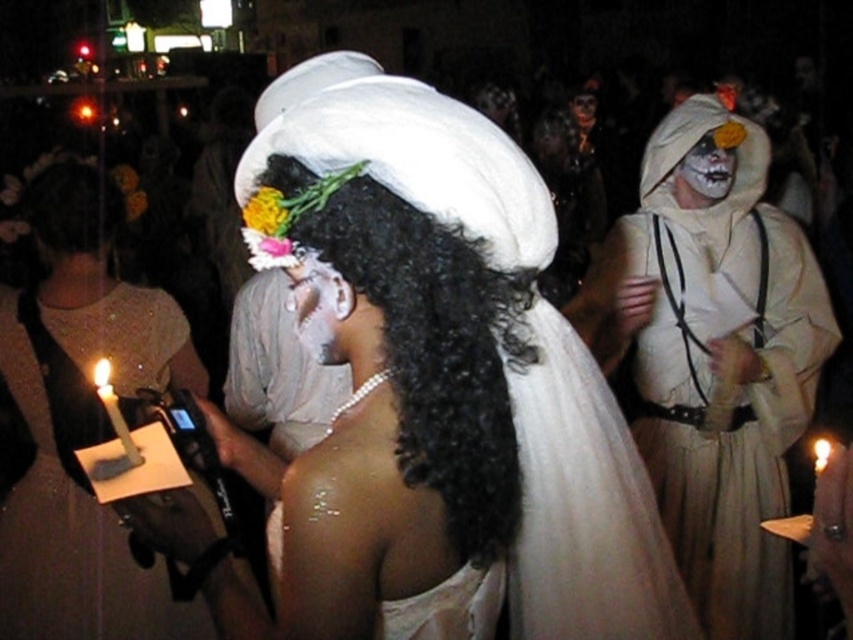
Based on the photo, who is more forward, [132,340] or [589,125]?

Point [132,340] is in front.

Who is lower down, white satin dress at lower left or smooth white mask at center?

white satin dress at lower left is lower down.

Describe the element at coordinates (70, 536) in the screenshot. I see `white satin dress at lower left` at that location.

At what (x,y) coordinates should I click in order to perform the action: click on white satin dress at lower left. Please return your answer as a coordinate pair (x, y). The height and width of the screenshot is (640, 853). Looking at the image, I should click on (70, 536).

Is matte white robe at right taller than black curly hair at center?

Yes.

Which is behind, point (726, 472) or point (418, 353)?

The point (726, 472) is more distant.

At what (x,y) coordinates should I click in order to perform the action: click on matte white robe at right. Please return your answer as a coordinate pair (x, y). The height and width of the screenshot is (640, 853). Looking at the image, I should click on (714, 362).

Which of these two, white satin dress at lower left or pearl necklace at upper center, stands shorter?

pearl necklace at upper center is shorter.

Is point (177, 323) closer to viewer compared to point (322, 346)?

That is False.

At what (x,y) coordinates should I click in order to perform the action: click on white satin dress at lower left. Please return your answer as a coordinate pair (x, y). This screenshot has width=853, height=640. Looking at the image, I should click on (70, 536).

This screenshot has width=853, height=640. In order to click on white satin dress at lower left in this screenshot , I will do `click(70, 536)`.